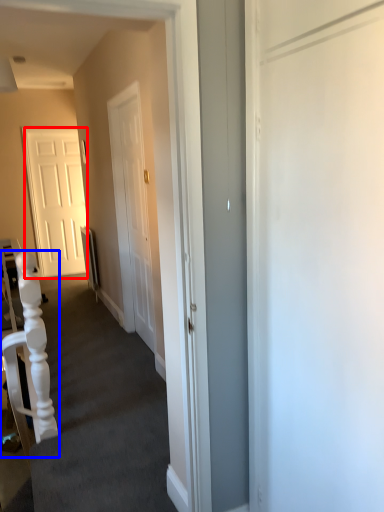
Question: Which object appears farthest to the camera in this image, door (highlighted by a red box) or armchair (highlighted by a blue box)?

Choices:
 (A) door
 (B) armchair

Answer: (A)